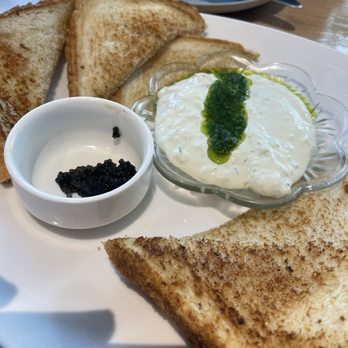
Identify the location of shadow of plate on tabletop. The height and width of the screenshot is (348, 348). (172, 194), (224, 209), (184, 198).